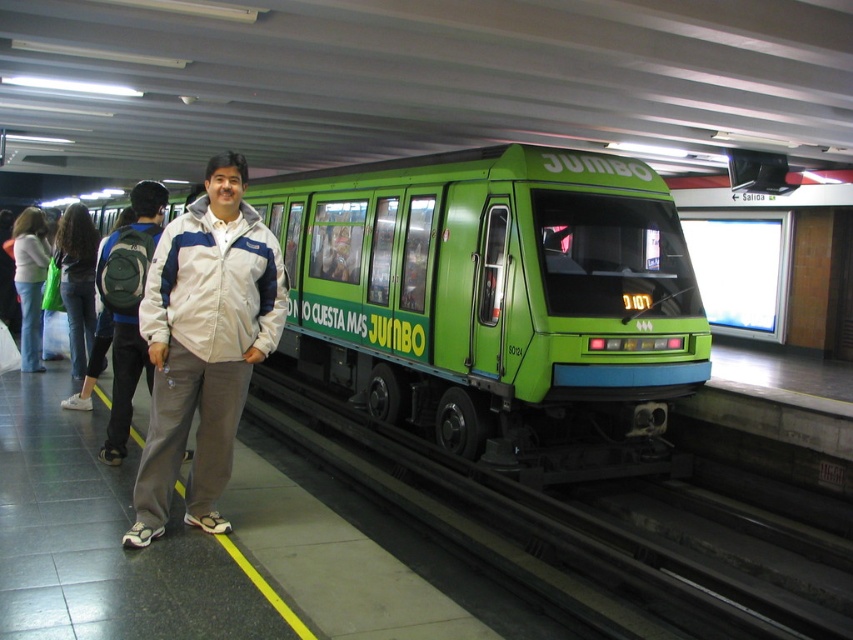
Based on the photo, you are a fashion designer observing the denim clothing items at the subway station. You notice the denim jeans at left and the denim jacket at left. Which item of clothing has a larger size?

The denim jeans at left is bigger than the denim jacket at left.

You are standing at the subway station and want to touch the white fabric jacket at center. If you move straight towards the point at coordinates (204, 342), will your hand reach the jacket?

The point at coordinates (204, 342) is on the white fabric jacket at center, so yes, moving straight towards that point will allow your hand to reach the jacket.

You are a passenger waiting at the subway station. You notice the green matte train at center and the denim jeans at left. Which object is shorter in height?

The green matte train at center is shorter in height compared to the denim jeans at left.